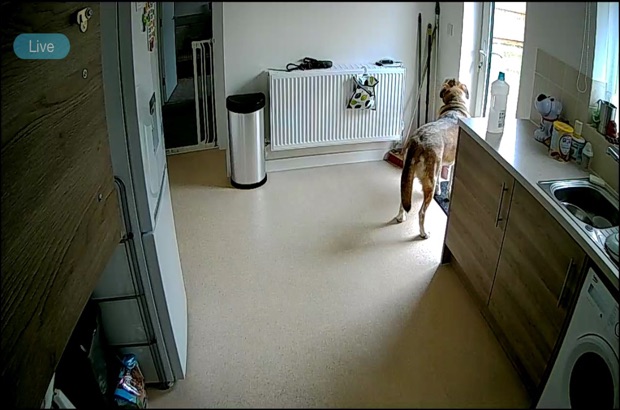
Where is `trash can`? This screenshot has height=410, width=620. trash can is located at coordinates (241, 142).